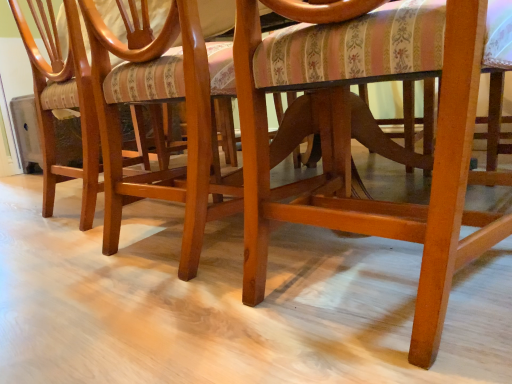
Measure the distance between point (x=88, y=113) and camera.

A distance of 3.87 feet exists between point (x=88, y=113) and camera.

What is the approximate height of glossy wood chair at lower left, the 2th chair viewed from the right?

glossy wood chair at lower left, the 2th chair viewed from the right, is 30.68 inches in height.

The height and width of the screenshot is (384, 512). What do you see at coordinates (63, 102) in the screenshot? I see `glossy wood chair at lower left, placed as the first chair when sorted from left to right` at bounding box center [63, 102].

Where is `glossy wood chair at lower left, the 2th chair viewed from the right`? This screenshot has width=512, height=384. glossy wood chair at lower left, the 2th chair viewed from the right is located at coordinates (63, 102).

The height and width of the screenshot is (384, 512). Identify the location of matte wood chair at center, acting as the 1th chair starting from the right. (161, 101).

The width and height of the screenshot is (512, 384). What do you see at coordinates (161, 101) in the screenshot? I see `matte wood chair at center, acting as the 1th chair starting from the right` at bounding box center [161, 101].

Locate an element on the screen. glossy wood chair at lower left, the 2th chair viewed from the right is located at coordinates (63, 102).

Does glossy wood chair at lower left, the 2th chair viewed from the right, appear on the left side of matte wood chair at center, acting as the 1th chair starting from the right?

Yes.

Which object is further away from the camera, glossy wood chair at lower left, the 2th chair viewed from the right, or matte wood chair at center, acting as the 1th chair starting from the right?

glossy wood chair at lower left, the 2th chair viewed from the right, is behind.

Considering the positions of points (65, 94) and (137, 15), is point (65, 94) closer to camera compared to point (137, 15)?

No, (65, 94) is behind (137, 15).

From the image's perspective, would you say glossy wood chair at lower left, the 2th chair viewed from the right, is positioned over matte wood chair at center, acting as the 1th chair starting from the right?

Correct, glossy wood chair at lower left, the 2th chair viewed from the right, appears higher than matte wood chair at center, acting as the 1th chair starting from the right, in the image.

From a real-world perspective, between glossy wood chair at lower left, placed as the first chair when sorted from left to right, and matte wood chair at center, which is the 2th chair from left to right, who is vertically lower?

matte wood chair at center, which is the 2th chair from left to right.

Is glossy wood chair at lower left, the 2th chair viewed from the right, thinner than matte wood chair at center, which is the 2th chair from left to right?

No, glossy wood chair at lower left, the 2th chair viewed from the right, is not thinner than matte wood chair at center, which is the 2th chair from left to right.

Considering the sizes of objects glossy wood chair at lower left, the 2th chair viewed from the right, and matte wood chair at center, which is the 2th chair from left to right, in the image provided, who is taller, glossy wood chair at lower left, the 2th chair viewed from the right, or matte wood chair at center, which is the 2th chair from left to right,?

With more height is glossy wood chair at lower left, the 2th chair viewed from the right.

Who is bigger, glossy wood chair at lower left, the 2th chair viewed from the right, or matte wood chair at center, which is the 2th chair from left to right?

With larger size is glossy wood chair at lower left, the 2th chair viewed from the right.

Is glossy wood chair at lower left, placed as the first chair when sorted from left to right, outside of matte wood chair at center, acting as the 1th chair starting from the right?

Absolutely, glossy wood chair at lower left, placed as the first chair when sorted from left to right, is external to matte wood chair at center, acting as the 1th chair starting from the right.

Are glossy wood chair at lower left, placed as the first chair when sorted from left to right, and matte wood chair at center, acting as the 1th chair starting from the right, beside each other?

There is a gap between glossy wood chair at lower left, placed as the first chair when sorted from left to right, and matte wood chair at center, acting as the 1th chair starting from the right.

Is glossy wood chair at lower left, the 2th chair viewed from the right, positioned with its back to matte wood chair at center, which is the 2th chair from left to right?

That's not correct — glossy wood chair at lower left, the 2th chair viewed from the right, is not looking away from matte wood chair at center, which is the 2th chair from left to right.

Consider the image. Could you measure the distance between glossy wood chair at lower left, the 2th chair viewed from the right, and matte wood chair at center, acting as the 1th chair starting from the right?

glossy wood chair at lower left, the 2th chair viewed from the right, is 11.16 inches from matte wood chair at center, acting as the 1th chair starting from the right.

The width and height of the screenshot is (512, 384). Find the location of `chair that appears above the matte wood chair at center, acting as the 1th chair starting from the right (from the image's perspective)`. chair that appears above the matte wood chair at center, acting as the 1th chair starting from the right (from the image's perspective) is located at coordinates (63, 102).

Considering the relative positions of matte wood chair at center, which is the 2th chair from left to right, and glossy wood chair at lower left, placed as the first chair when sorted from left to right, in the image provided, is matte wood chair at center, which is the 2th chair from left to right, to the right of glossy wood chair at lower left, placed as the first chair when sorted from left to right, from the viewer's perspective?

Yes, matte wood chair at center, which is the 2th chair from left to right, is to the right of glossy wood chair at lower left, placed as the first chair when sorted from left to right.

Looking at this image, which object is further away from the camera taking this photo, matte wood chair at center, acting as the 1th chair starting from the right, or glossy wood chair at lower left, placed as the first chair when sorted from left to right?

glossy wood chair at lower left, placed as the first chair when sorted from left to right, is further away from the camera.

Is point (111, 39) in front of point (88, 110)?

Yes, it is in front of point (88, 110).

From the image's perspective, is matte wood chair at center, acting as the 1th chair starting from the right, located beneath glossy wood chair at lower left, the 2th chair viewed from the right?

Indeed, from the image's perspective, matte wood chair at center, acting as the 1th chair starting from the right, is shown beneath glossy wood chair at lower left, the 2th chair viewed from the right.

In the scene shown: From a real-world perspective, who is located lower, matte wood chair at center, acting as the 1th chair starting from the right, or glossy wood chair at lower left, the 2th chair viewed from the right?

matte wood chair at center, acting as the 1th chair starting from the right, from a real-world perspective.

Does matte wood chair at center, acting as the 1th chair starting from the right, have a greater width compared to glossy wood chair at lower left, placed as the first chair when sorted from left to right?

Incorrect, the width of matte wood chair at center, acting as the 1th chair starting from the right, does not surpass that of glossy wood chair at lower left, placed as the first chair when sorted from left to right.

Who is taller, matte wood chair at center, acting as the 1th chair starting from the right, or glossy wood chair at lower left, placed as the first chair when sorted from left to right?

With more height is glossy wood chair at lower left, placed as the first chair when sorted from left to right.

Between matte wood chair at center, acting as the 1th chair starting from the right, and glossy wood chair at lower left, placed as the first chair when sorted from left to right, which one has smaller size?

Smaller between the two is matte wood chair at center, acting as the 1th chair starting from the right.

Is matte wood chair at center, which is the 2th chair from left to right, completely or partially outside of glossy wood chair at lower left, placed as the first chair when sorted from left to right?

Yes.

Is matte wood chair at center, acting as the 1th chair starting from the right, directly adjacent to glossy wood chair at lower left, placed as the first chair when sorted from left to right?

No, matte wood chair at center, acting as the 1th chair starting from the right, is not making contact with glossy wood chair at lower left, placed as the first chair when sorted from left to right.

Is matte wood chair at center, acting as the 1th chair starting from the right, facing away from glossy wood chair at lower left, placed as the first chair when sorted from left to right?

That's not correct — matte wood chair at center, acting as the 1th chair starting from the right, is not looking away from glossy wood chair at lower left, placed as the first chair when sorted from left to right.

What's the angular difference between matte wood chair at center, which is the 2th chair from left to right, and glossy wood chair at lower left, placed as the first chair when sorted from left to right,'s facing directions?

The angle between the facing direction of matte wood chair at center, which is the 2th chair from left to right, and the facing direction of glossy wood chair at lower left, placed as the first chair when sorted from left to right, is 2.86 degrees.

Measure the distance between matte wood chair at center, which is the 2th chair from left to right, and glossy wood chair at lower left, the 2th chair viewed from the right.

11.16 inches.

At what (x,y) coordinates should I click in order to perform the action: click on chair located above the matte wood chair at center, which is the 2th chair from left to right (from the image's perspective). Please return your answer as a coordinate pair (x, y). This screenshot has width=512, height=384. Looking at the image, I should click on [63, 102].

Identify the location of chair located above the matte wood chair at center, which is the 2th chair from left to right (from a real-world perspective). (63, 102).

At what (x,y) coordinates should I click in order to perform the action: click on chair below the glossy wood chair at lower left, placed as the first chair when sorted from left to right (from a real-world perspective). Please return your answer as a coordinate pair (x, y). Image resolution: width=512 pixels, height=384 pixels. Looking at the image, I should click on (161, 101).